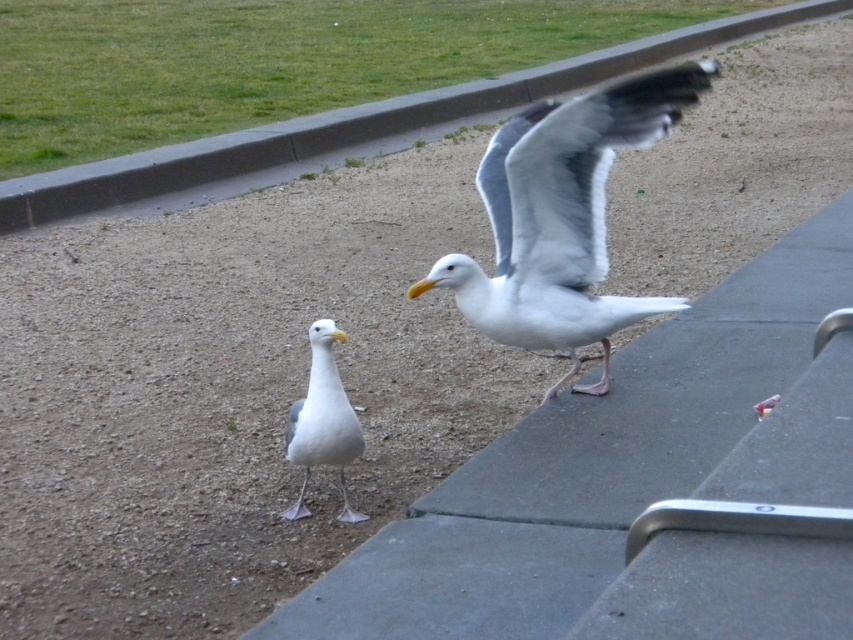
You are standing at the camera position and want to take a photo of the white feathered bird at center. The camera has a maximum focus range of 10 feet. Will the camera be able to focus on the bird?

The white feathered bird at center and camera are 9.64 feet apart, so the camera can focus on the bird since the distance is within the 10 feet maximum focus range.

You are standing at a point 25.52 feet away from the seagulls in the image. If you want to throw a small pebble to hit the seagull located at point (173, 188), will you be able to reach it?

The point (173, 188) is 25.52 feet away from you, so yes, you can reach it by throwing the pebble that distance.

You are standing at the edge of the sandy area and want to place a small flag at each of the two points shown in the image. Which point, point (183, 152) or point (323, 349), is closer to you when you are facing the scene?

Point (183, 152) is closer to you because it is further to the camera than point (323, 349), meaning it appears nearer in the scene.